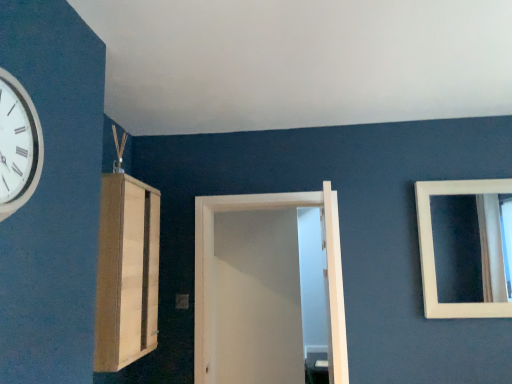
Question: Is white matte door at center to the left or to the right of white glossy clock at upper left in the image?

Choices:
 (A) left
 (B) right

Answer: (B)

Question: From the image's perspective, is white matte door at center located above or below white glossy clock at upper left?

Choices:
 (A) above
 (B) below

Answer: (B)

Question: Based on their relative distances, which object is nearer to the white matte door at center?

Choices:
 (A) light wood cabinet at left
 (B) white glossy clock at upper left
 (C) white matte mirror at upper right

Answer: (A)

Question: Which object is the closest to the white matte mirror at upper right?

Choices:
 (A) white matte door at center
 (B) light wood cabinet at left
 (C) white glossy clock at upper left

Answer: (A)